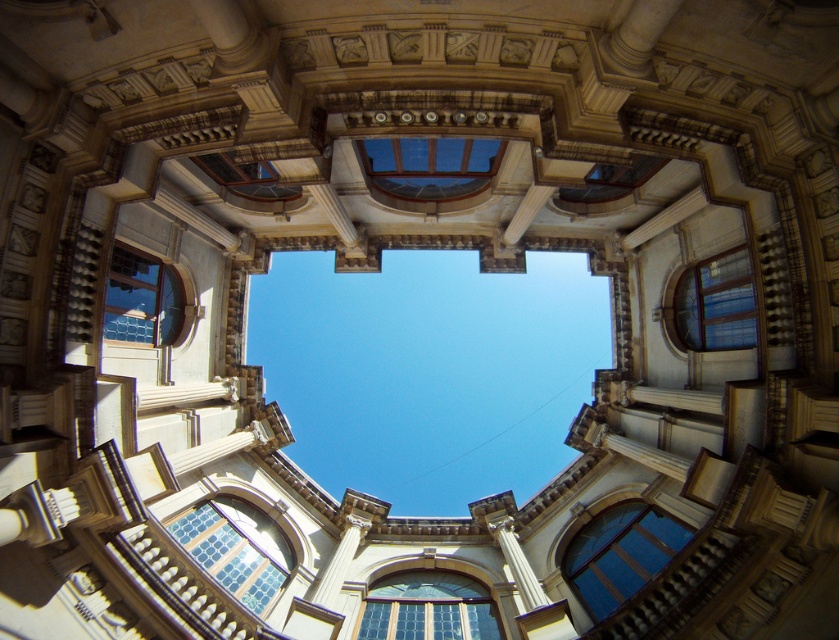
Question: Which is farther from the clear glass window at right?

Choices:
 (A) blue glass window at lower right
 (B) matte glass window at upper center
 (C) stained glass window at left

Answer: (C)

Question: Which object is farther from the camera taking this photo?

Choices:
 (A) stained glass window at lower left
 (B) matte glass window at upper center

Answer: (A)

Question: From the image, what is the correct spatial relationship of stained glass window at center in relation to matte glass window at upper center?

Choices:
 (A) left
 (B) right

Answer: (A)

Question: Does stained glass window at center have a greater width compared to clear glass window at right?

Choices:
 (A) yes
 (B) no

Answer: (A)

Question: Is stained glass window at center thinner than matte glass window at upper center?

Choices:
 (A) no
 (B) yes

Answer: (A)

Question: Which is nearer to the stained glass window at lower left?

Choices:
 (A) stained glass window at left
 (B) matte glass window at upper center
 (C) clear glass window at center

Answer: (A)